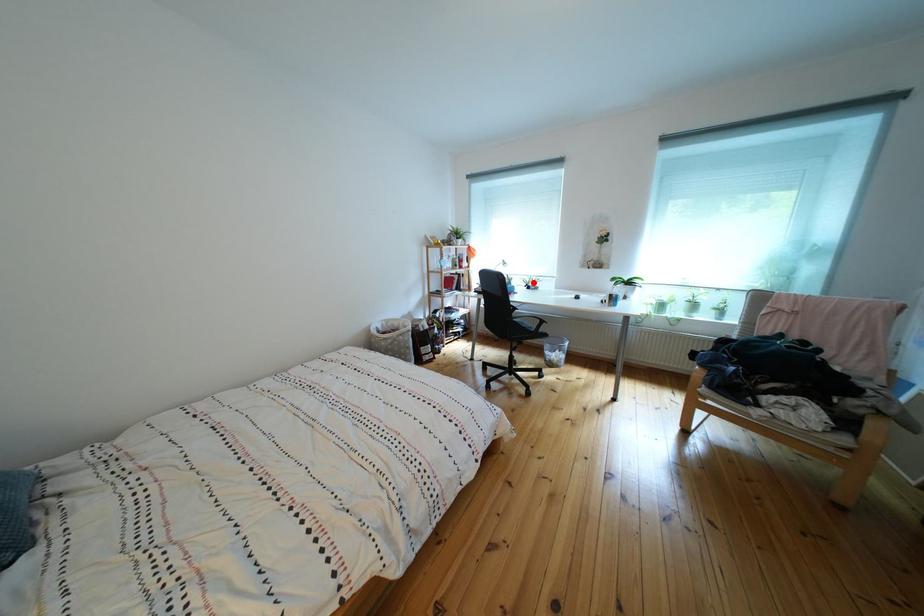
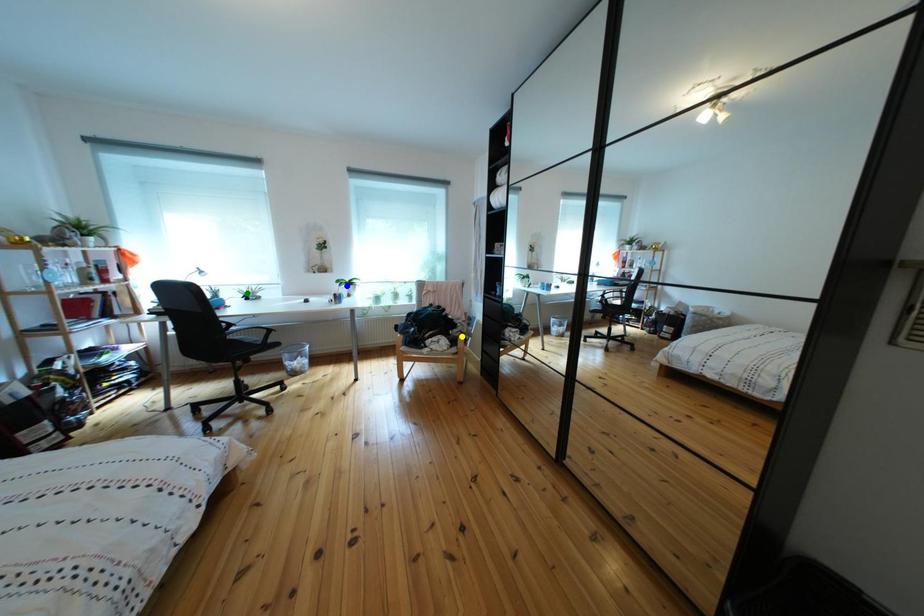
Question: I am providing you with two images of the same scene from different viewpoints. A red point is marked on the first image. You are given multiple points on the second image. Which spot in image 2 lines up with the point in image 1?

Choices:
 (A) blue point
 (B) green point
 (C) yellow point

Answer: (B)